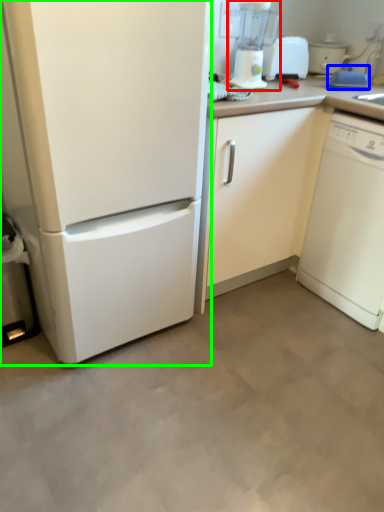
Question: Which is farther away from blender (highlighted by a red box)? appliance (highlighted by a blue box) or home appliance (highlighted by a green box)?

Choices:
 (A) appliance
 (B) home appliance

Answer: (B)